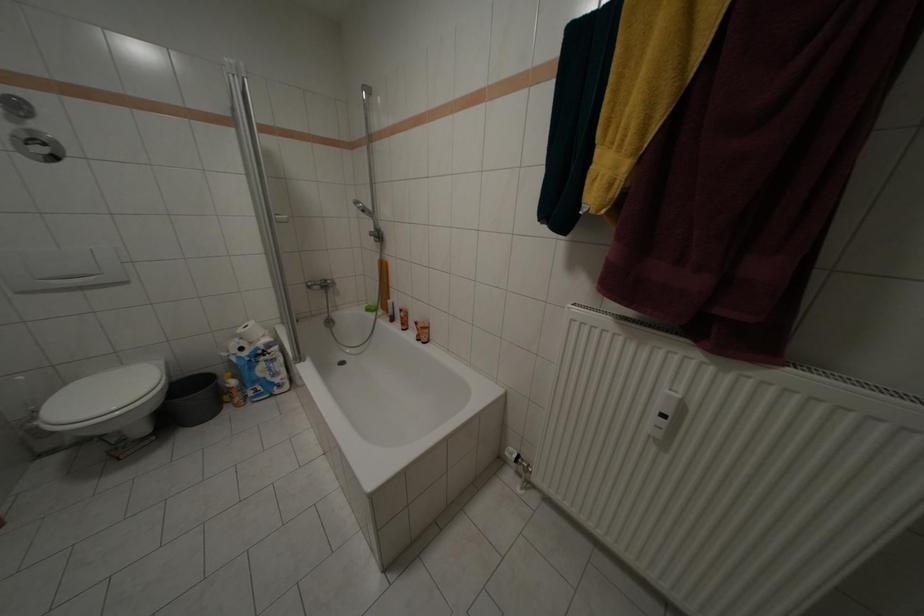
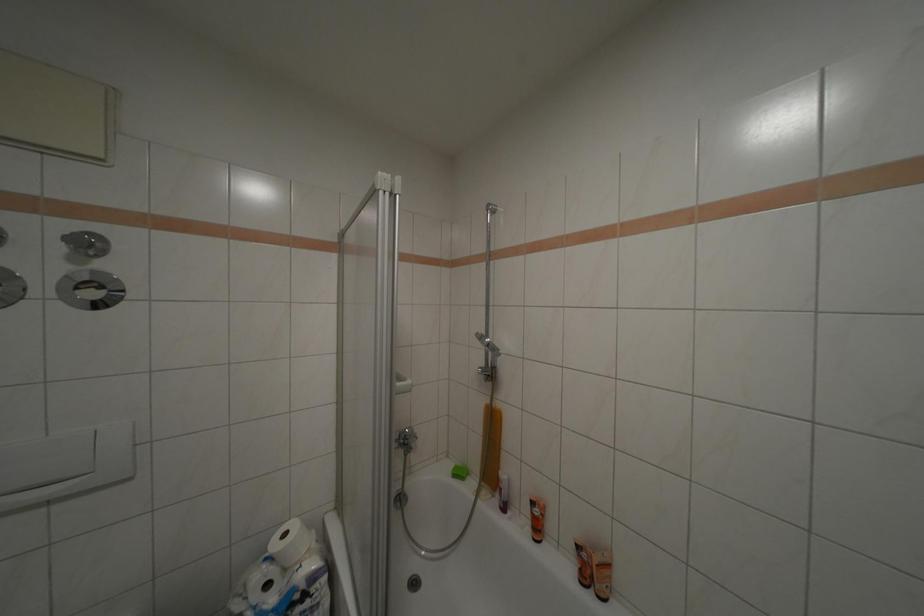
Question: How did the camera likely rotate?

Choices:
 (A) Left
 (B) Right
 (C) Up
 (D) Down

Answer: (C)